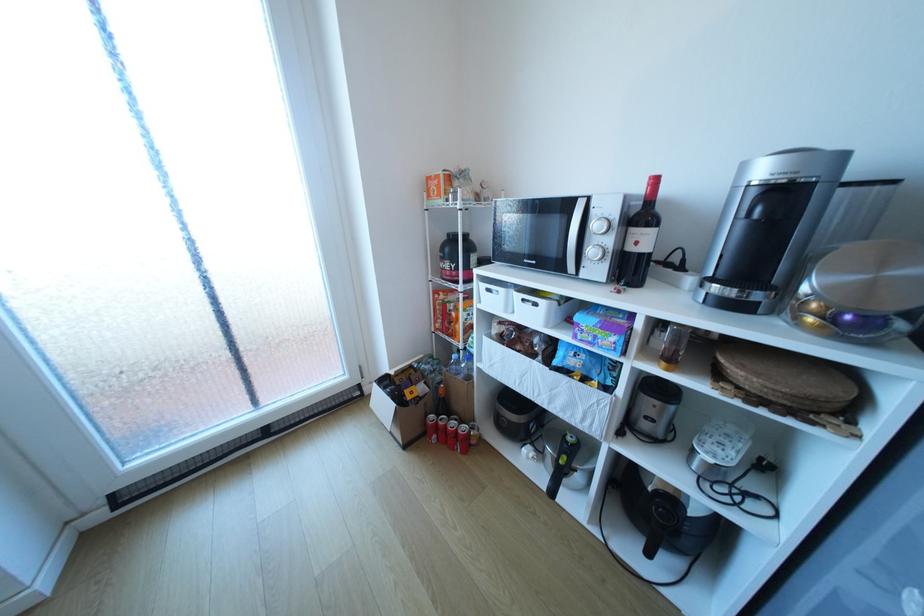
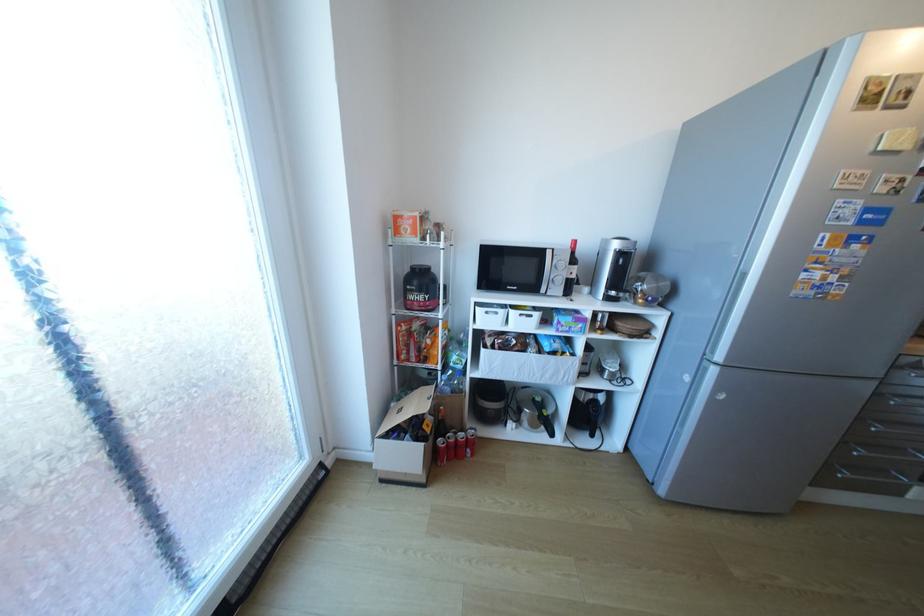
Where in the second image is the point corresponding to (394,389) from the first image?

(407, 437)